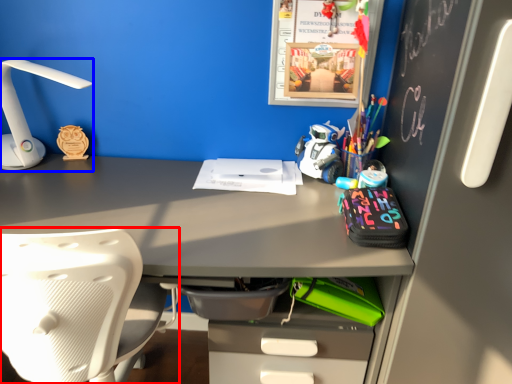
Question: Which object appears farthest to the camera in this image, chair (highlighted by a red box) or lamp (highlighted by a blue box)?

Choices:
 (A) chair
 (B) lamp

Answer: (B)